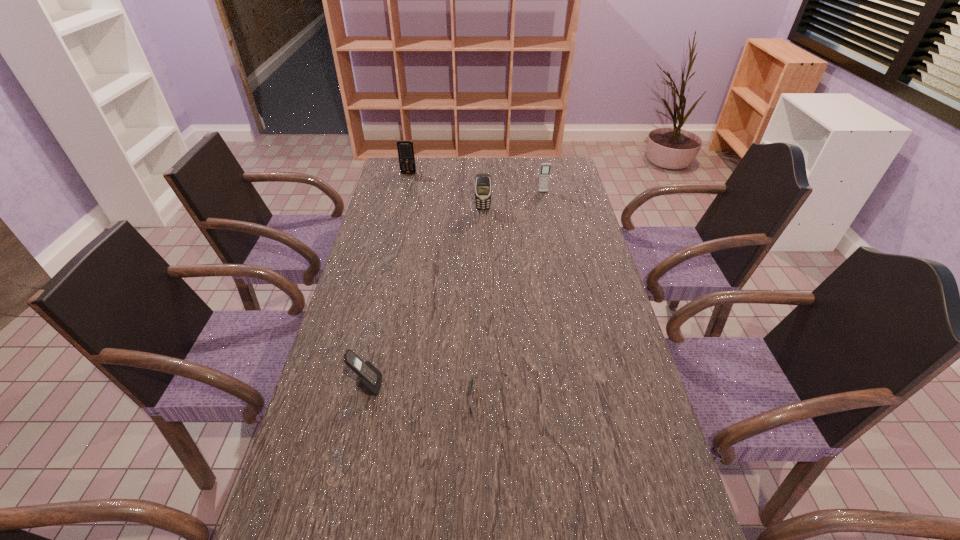
Locate an element on the screen. vacant space that's between the farthest object and the third farthest cellular telephone is located at coordinates (445, 191).

Where is `free area in between the third cellular telephone from left to right and the nearest cellular telephone`? free area in between the third cellular telephone from left to right and the nearest cellular telephone is located at coordinates (425, 298).

At what (x,y) coordinates should I click in order to perform the action: click on free space that is in between the second cellular telephone from right to left and the farthest object. Please return your answer as a coordinate pair (x, y). The width and height of the screenshot is (960, 540). Looking at the image, I should click on (445, 191).

You are a GUI agent. You are given a task and a screenshot of the screen. Output one action in this format:
    pyautogui.click(x=<x>, y=<y>)
    Task: Click on the unoccupied position between the third farthest object and the shortest object
    The image size is (960, 540).
    Given the screenshot: What is the action you would take?
    pyautogui.click(x=487, y=306)

I want to click on empty location between the third farthest object and the sunglasses, so click(487, 306).

Identify the location of object that is the third closest to the nearest cellular telephone. (545, 167).

Locate which object is the closest to the fourth nearest object. Please provide its 2D coordinates. Your answer should be formatted as a tuple, i.e. [(x, y)], where the tuple contains the x and y coordinates of a point satisfying the conditions above.

[(483, 187)]

Identify the location of cellular telephone identified as the third closest to the rightmost object. (369, 379).

Select which cellular telephone is the third closest to the second cellular telephone from right to left. Please provide its 2D coordinates. Your answer should be formatted as a tuple, i.e. [(x, y)], where the tuple contains the x and y coordinates of a point satisfying the conditions above.

[(369, 379)]